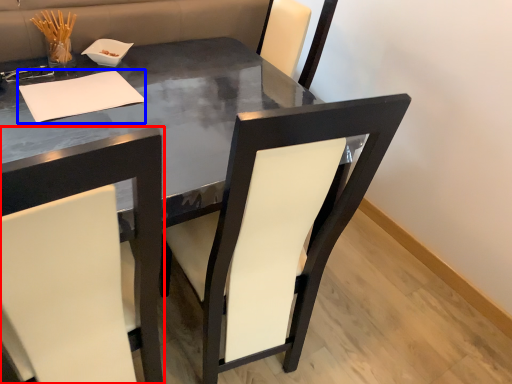
Question: Which point is closer to the camera, chair (highlighted by a red box) or notepad (highlighted by a blue box)?

Choices:
 (A) chair
 (B) notepad

Answer: (A)